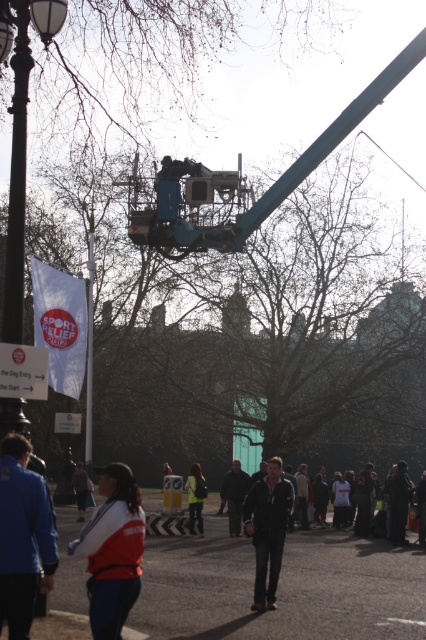
Does blue fabric jacket at lower left have a lesser height compared to dark blue jacket at center?

Indeed, blue fabric jacket at lower left has a lesser height compared to dark blue jacket at center.

Which is above, blue fabric jacket at lower left or dark blue jacket at center?

blue fabric jacket at lower left is above.

Where is `blue fabric jacket at lower left`? blue fabric jacket at lower left is located at coordinates (23, 536).

Find the location of a particular element. blue fabric jacket at lower left is located at coordinates (23, 536).

Who is lower down, red fabric vest at lower center or dark gray fabric jacket at center?

dark gray fabric jacket at center is below.

Which is behind, point (111, 465) or point (233, 506)?

The point (233, 506) is behind.

Is point (100, 525) positioned in front of point (235, 515)?

Yes.

You are a GUI agent. You are given a task and a screenshot of the screen. Output one action in this format:
    pyautogui.click(x=<x>, y=<y>)
    Task: Click on the red fabric vest at lower center
    This screenshot has height=640, width=426.
    Given the screenshot: What is the action you would take?
    pyautogui.click(x=112, y=550)

Is the position of red fabric vest at lower center less distant than that of dark blue jacket at center?

Yes, it is.

The height and width of the screenshot is (640, 426). What do you see at coordinates (112, 550) in the screenshot? I see `red fabric vest at lower center` at bounding box center [112, 550].

Who is more forward, [109,564] or [265,589]?

Positioned in front is point [109,564].

Locate an element on the screen. This screenshot has height=640, width=426. red fabric vest at lower center is located at coordinates (112, 550).